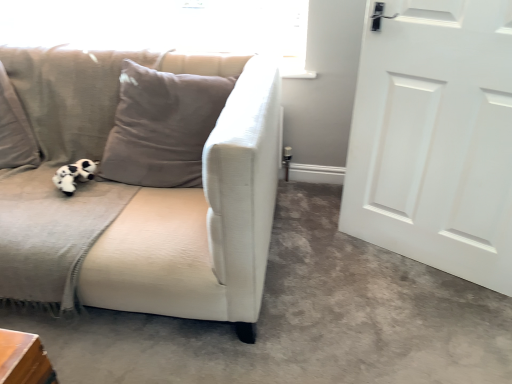
What do you see at coordinates (165, 26) in the screenshot?
I see `transparent glass window screen at upper left` at bounding box center [165, 26].

The image size is (512, 384). Identify the location of transparent glass window screen at upper left. (165, 26).

In order to face black plush toy at left, should I rotate leftwards or rightwards?

Turn left by 23.065 degrees to look at black plush toy at left.

Identify the location of white fabric couch at left. (301, 319).

Identify the location of transparent glass window screen at upper left. The height and width of the screenshot is (384, 512). (165, 26).

Is matte gray cushion at center smaller than transparent glass window screen at upper left?

No, matte gray cushion at center is not smaller than transparent glass window screen at upper left.

Considering the relative sizes of matte gray cushion at center and transparent glass window screen at upper left in the image provided, is matte gray cushion at center shorter than transparent glass window screen at upper left?

No, matte gray cushion at center is not shorter than transparent glass window screen at upper left.

Is matte gray cushion at center directly adjacent to transparent glass window screen at upper left?

They are not placed beside each other.

From a real-world perspective, relative to transparent glass window screen at upper left, is matte gray cushion at center vertically above or below?

In terms of real-world spatial position, matte gray cushion at center is below transparent glass window screen at upper left.

In the scene shown: Is white fabric couch at left bigger or smaller than white matte door at right?

In the image, white fabric couch at left appears to be larger than white matte door at right.

You are a GUI agent. You are given a task and a screenshot of the screen. Output one action in this format:
    pyautogui.click(x=<x>, y=<y>)
    Task: Click on the door located above the white fabric couch at left (from a real-world perspective)
    This screenshot has height=384, width=512.
    Given the screenshot: What is the action you would take?
    pyautogui.click(x=435, y=138)

From a real-world perspective, which object stands above the other?

white matte door at right is physically above.

Is matte gray cushion at center to the left or to the right of beige fabric couch at left in the image?

From the image, it's evident that matte gray cushion at center is to the right of beige fabric couch at left.

Is matte gray cushion at center positioned with its back to beige fabric couch at left?

No, matte gray cushion at center is not facing away from beige fabric couch at left.

Which point is more distant from viewer, (x=202, y=130) or (x=58, y=227)?

The point (x=202, y=130) is more distant.

Is matte gray cushion at center positioned beyond the bounds of white matte door at right?

Absolutely, matte gray cushion at center is external to white matte door at right.

How different are the orientations of matte gray cushion at center and white matte door at right in degrees?

There is a 26.1-degree angle between the facing directions of matte gray cushion at center and white matte door at right.

From the image's perspective, is matte gray cushion at center under white matte door at right?

No.

Considering the sizes of objects matte gray cushion at center and white matte door at right in the image provided, who is wider, matte gray cushion at center or white matte door at right?

With larger width is matte gray cushion at center.

Do you think white matte door at right is within transparent glass window screen at upper left, or outside of it?

white matte door at right is outside transparent glass window screen at upper left.

Considering the positions of objects white matte door at right and transparent glass window screen at upper left in the image provided, who is more to the left, white matte door at right or transparent glass window screen at upper left?

Positioned to the left is transparent glass window screen at upper left.

Is white matte door at right bigger than transparent glass window screen at upper left?

Correct, white matte door at right is larger in size than transparent glass window screen at upper left.

Which object is thinner, white matte door at right or transparent glass window screen at upper left?

With smaller width is transparent glass window screen at upper left.

From the image's perspective, is white matte door at right positioned above or below matte gray cushion at center?

Based on their image positions, white matte door at right is located beneath matte gray cushion at center.

Is white matte door at right oriented away from matte gray cushion at center?

No, white matte door at right is not facing the opposite direction of matte gray cushion at center.

From their relative heights in the image, would you say white matte door at right is taller or shorter than matte gray cushion at center?

In the image, white matte door at right appears to be taller than matte gray cushion at center.

Is white matte door at right next to matte gray cushion at center?

There is a gap between white matte door at right and matte gray cushion at center.

Considering the positions of objects beige fabric couch at left and transparent glass window screen at upper left in the image provided, who is behind, beige fabric couch at left or transparent glass window screen at upper left?

transparent glass window screen at upper left is more distant.

Could you tell me if beige fabric couch at left is turned towards transparent glass window screen at upper left?

No, beige fabric couch at left is not oriented towards transparent glass window screen at upper left.

Can you confirm if beige fabric couch at left is wider than transparent glass window screen at upper left?

Yes.

Visually, is beige fabric couch at left positioned to the left or to the right of transparent glass window screen at upper left?

beige fabric couch at left is positioned on transparent glass window screen at upper left's left side.

Where is `window screen on the left of the matte gray cushion at center`? The height and width of the screenshot is (384, 512). window screen on the left of the matte gray cushion at center is located at coordinates (165, 26).

Where is `concrete beneath the white matte door at right (from a real-world perspective)`? Image resolution: width=512 pixels, height=384 pixels. concrete beneath the white matte door at right (from a real-world perspective) is located at coordinates (301, 319).

When comparing their distances from black plush toy at left, does transparent glass window screen at upper left or white fabric couch at left seem further?

The object further to black plush toy at left is transparent glass window screen at upper left.

Based on their spatial positions, is black plush toy at left or matte gray cushion at center further from white matte door at right?

Based on the image, black plush toy at left appears to be further to white matte door at right.

From the image, which object appears to be nearer to matte gray cushion at center, black plush toy at left or beige fabric couch at left?

beige fabric couch at left.

Which object lies nearer to the anchor point white fabric couch at left, matte gray cushion at center or black plush toy at left?

Among the two, matte gray cushion at center is located nearer to white fabric couch at left.

Estimate the real-world distances between objects in this image. Which object is closer to black plush toy at left, transparent glass window screen at upper left or matte gray cushion at center?

Based on the image, matte gray cushion at center appears to be nearer to black plush toy at left.

Estimate the real-world distances between objects in this image. Which object is further from white fabric couch at left, black plush toy at left or white matte door at right?

black plush toy at left lies further to white fabric couch at left than the other object.

Estimate the real-world distances between objects in this image. Which object is further from matte gray cushion at center, beige fabric couch at left or white fabric couch at left?

white fabric couch at left.

Looking at the image, which one is located closer to white fabric couch at left, matte gray cushion at center or white matte door at right?

The object closer to white fabric couch at left is white matte door at right.

Identify the location of concrete located between transparent glass window screen at upper left and white matte door at right in the left-right direction. (301, 319).

Identify the location of pillow between beige fabric couch at left and white fabric couch at left in the horizontal direction. (162, 127).

At what (x,y) coordinates should I click in order to perform the action: click on pillow between beige fabric couch at left and black plush toy at left in the front-back direction. Please return your answer as a coordinate pair (x, y). The height and width of the screenshot is (384, 512). Looking at the image, I should click on (162, 127).

The height and width of the screenshot is (384, 512). I want to click on pillow between beige fabric couch at left and white matte door at right, so click(162, 127).